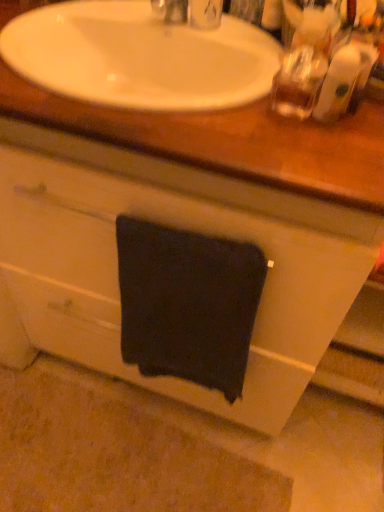
Question: Considering the positions of white glossy sink at upper center and dark fabric towel at center in the image, is white glossy sink at upper center taller or shorter than dark fabric towel at center?

Choices:
 (A) tall
 (B) short

Answer: (B)

Question: Based on their sizes in the image, would you say white glossy sink at upper center is bigger or smaller than dark fabric towel at center?

Choices:
 (A) small
 (B) big

Answer: (B)

Question: Is white glossy sink at upper center spatially inside dark fabric towel at center, or outside of it?

Choices:
 (A) outside
 (B) inside

Answer: (A)

Question: Do you think dark fabric towel at center is within white glossy sink at upper center, or outside of it?

Choices:
 (A) inside
 (B) outside

Answer: (B)

Question: Considering the positions of dark fabric towel at center and white glossy sink at upper center in the image, is dark fabric towel at center bigger or smaller than white glossy sink at upper center?

Choices:
 (A) small
 (B) big

Answer: (A)

Question: Considering the positions of point (152, 330) and point (170, 140), is point (152, 330) closer or farther from the camera than point (170, 140)?

Choices:
 (A) farther
 (B) closer

Answer: (A)

Question: In terms of height, does dark fabric towel at center look taller or shorter compared to white glossy sink at upper center?

Choices:
 (A) short
 (B) tall

Answer: (B)